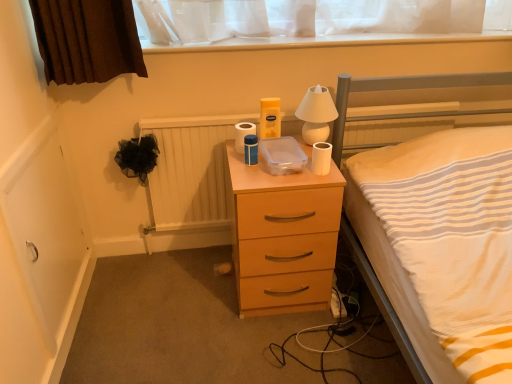
Question: Does white glossy lamp at upper center appear on the left side of wooden radiator at center?

Choices:
 (A) no
 (B) yes

Answer: (A)

Question: Is white glossy lamp at upper center positioned beyond the bounds of wooden radiator at center?

Choices:
 (A) yes
 (B) no

Answer: (A)

Question: Is white glossy lamp at upper center shorter than wooden radiator at center?

Choices:
 (A) yes
 (B) no

Answer: (A)

Question: Considering the relative sizes of white glossy lamp at upper center and wooden radiator at center in the image provided, is white glossy lamp at upper center wider than wooden radiator at center?

Choices:
 (A) no
 (B) yes

Answer: (B)

Question: Does white glossy lamp at upper center come behind wooden radiator at center?

Choices:
 (A) no
 (B) yes

Answer: (A)

Question: Considering the positions of point (344, 180) and point (240, 129), is point (344, 180) closer or farther from the camera than point (240, 129)?

Choices:
 (A) closer
 (B) farther

Answer: (A)

Question: Based on their positions, is matte wood chest of drawers at center located to the left or right of white matte toilet paper at center, which is the 2th toilet paper in front-to-back order?

Choices:
 (A) left
 (B) right

Answer: (B)

Question: In terms of height, does matte wood chest of drawers at center look taller or shorter compared to white matte toilet paper at center, arranged as the second toilet paper when viewed from the right?

Choices:
 (A) tall
 (B) short

Answer: (A)

Question: Considering the positions of matte wood chest of drawers at center and white matte toilet paper at center, acting as the first toilet paper starting from the left, in the image, is matte wood chest of drawers at center bigger or smaller than white matte toilet paper at center, acting as the first toilet paper starting from the left,?

Choices:
 (A) big
 (B) small

Answer: (A)

Question: In the image, is white matte toilet paper at right, which is the second toilet paper in back-to-front order, positioned in front of or behind white glossy lamp at upper center?

Choices:
 (A) behind
 (B) front

Answer: (B)

Question: In terms of height, does white matte toilet paper at right, which is the second toilet paper in back-to-front order, look taller or shorter compared to white glossy lamp at upper center?

Choices:
 (A) tall
 (B) short

Answer: (B)

Question: In the image, is white matte toilet paper at right, which ranks as the 1th toilet paper in front-to-back order, on the left side or the right side of white glossy lamp at upper center?

Choices:
 (A) left
 (B) right

Answer: (A)

Question: Based on their sizes in the image, would you say white matte toilet paper at right, the 1th toilet paper positioned from the right, is bigger or smaller than white glossy lamp at upper center?

Choices:
 (A) big
 (B) small

Answer: (B)

Question: From the image's perspective, is wooden radiator at center above or below white matte toilet paper at right, the second toilet paper viewed from the left?

Choices:
 (A) below
 (B) above

Answer: (A)

Question: In the image, is wooden radiator at center positioned in front of or behind white matte toilet paper at right, which is the second toilet paper in back-to-front order?

Choices:
 (A) behind
 (B) front

Answer: (A)